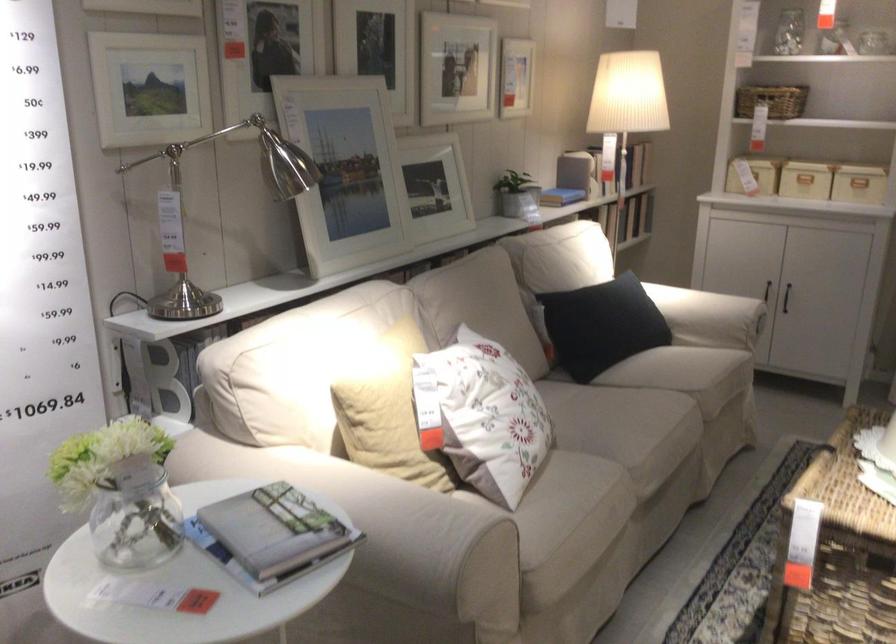
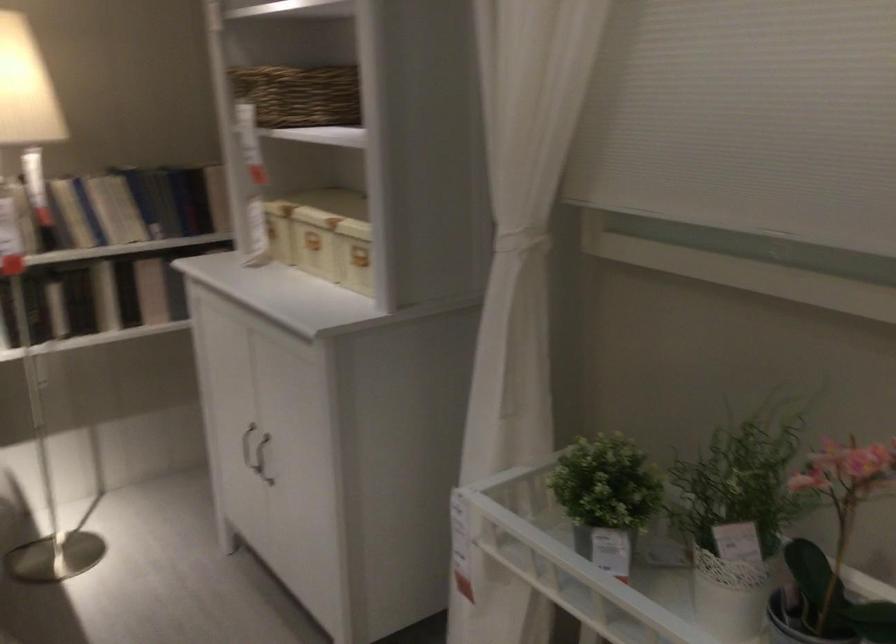
Locate, in the second image, the point that corresponds to point (767, 152) in the first image.

(270, 230)